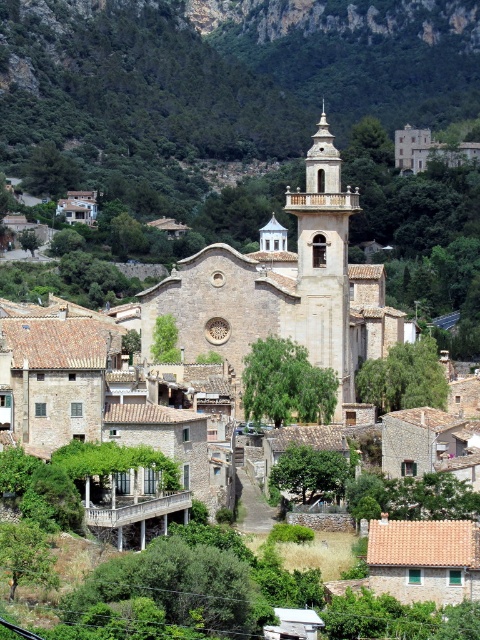
Question: Is green leafy mountain at upper center smaller than light beige stone church at center?

Choices:
 (A) no
 (B) yes

Answer: (A)

Question: Does green leafy mountain at upper center lie behind light beige stone church at center?

Choices:
 (A) no
 (B) yes

Answer: (B)

Question: Which object is closer to the camera taking this photo?

Choices:
 (A) green leafy mountain at upper center
 (B) light beige stone church at center

Answer: (B)

Question: Can you confirm if green leafy mountain at upper center is positioned to the right of light beige stone church at center?

Choices:
 (A) yes
 (B) no

Answer: (B)

Question: Among these objects, which one is nearest to the camera?

Choices:
 (A) light beige stone church at center
 (B) green leafy mountain at upper center

Answer: (A)

Question: Which point is farther to the camera?

Choices:
 (A) light beige stone church at center
 (B) green leafy mountain at upper center

Answer: (B)